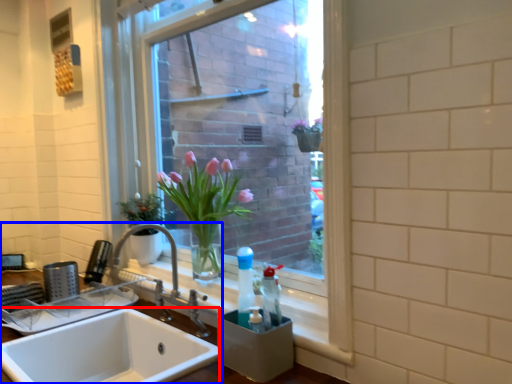
Question: Which object appears farthest to the camera in this image, sink (highlighted by a red box) or sink (highlighted by a blue box)?

Choices:
 (A) sink
 (B) sink

Answer: (A)